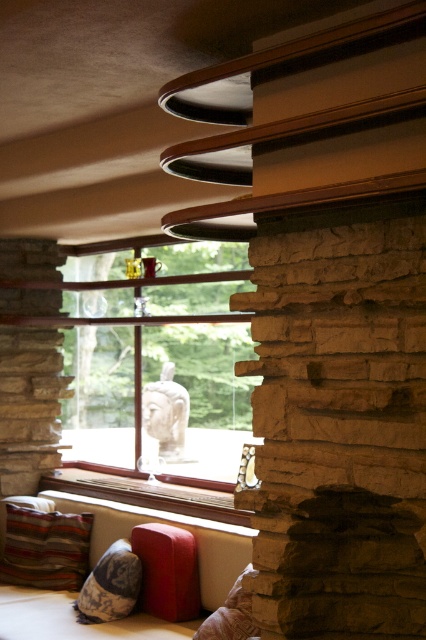
Question: Can you confirm if clear glass window at center is positioned to the right of velvety brown pillow at lower center?

Choices:
 (A) no
 (B) yes

Answer: (A)

Question: Does striped fabric pillow at lower left appear on the left side of wooden at center?

Choices:
 (A) yes
 (B) no

Answer: (A)

Question: Is clear glass window at center wider than velvet red couch at lower center?

Choices:
 (A) yes
 (B) no

Answer: (B)

Question: Based on their relative distances, which object is nearer to the striped fabric pillow at lower left?

Choices:
 (A) velvety brown pillow at lower center
 (B) velvet red couch at lower center
 (C) textured beige pillow at lower left
 (D) wooden at center

Answer: (B)

Question: Among these points, which one is farthest from the camera?

Choices:
 (A) (245, 524)
 (B) (190, 397)

Answer: (B)

Question: Among these objects, which one is farthest from the camera?

Choices:
 (A) textured beige pillow at lower left
 (B) velvety brown pillow at lower center
 (C) striped fabric pillow at lower left

Answer: (C)